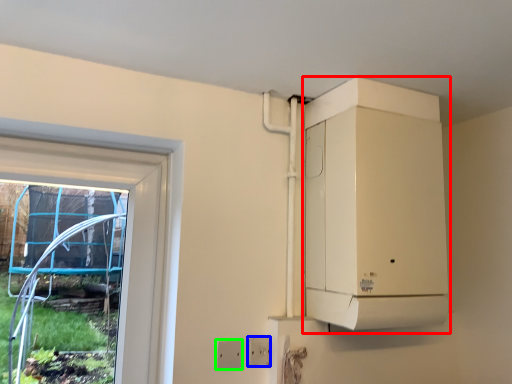
Question: Which object is positioned closest to appliance (highlighted by a red box)? Select from electric outlet (highlighted by a blue box) and electric outlet (highlighted by a green box).

Choices:
 (A) electric outlet
 (B) electric outlet

Answer: (A)